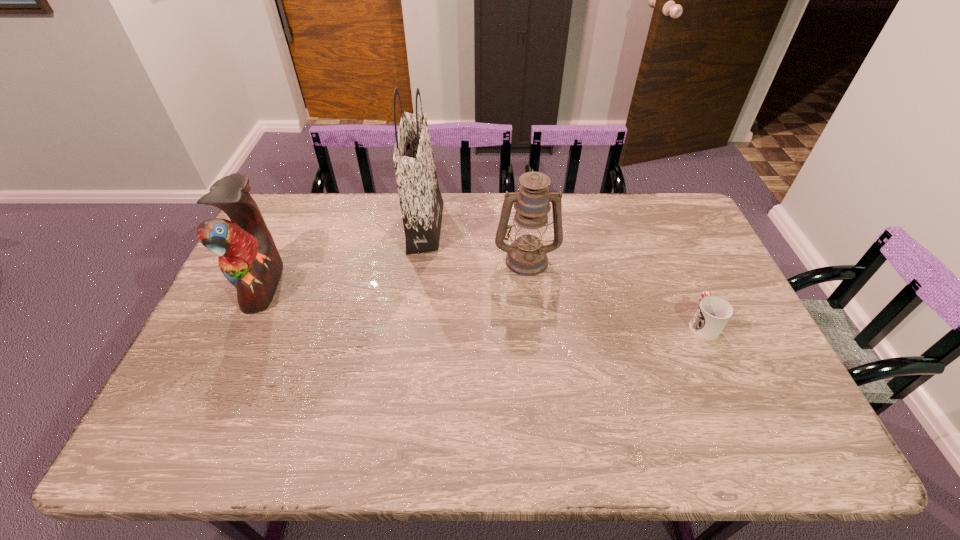
The image size is (960, 540). I want to click on object that is the second closest to the tallest object, so click(x=248, y=258).

Locate an element on the screen. This screenshot has width=960, height=540. object that is the second closest one to the cup is located at coordinates (421, 202).

Image resolution: width=960 pixels, height=540 pixels. Identify the location of vacant space that satisfies the following two spatial constraints: 1. on the front of the shopping bag with the design; 2. on the back side of the third object from left to right. (420, 259).

The width and height of the screenshot is (960, 540). Find the location of `vacant space that satisfies the following two spatial constraints: 1. on the handle side of the cup; 2. at the face of the leftmost object`. vacant space that satisfies the following two spatial constraints: 1. on the handle side of the cup; 2. at the face of the leftmost object is located at coordinates (685, 285).

This screenshot has height=540, width=960. Find the location of `vacant region that satisfies the following two spatial constraints: 1. at the face of the parrot; 2. on the handle side of the rightmost object`. vacant region that satisfies the following two spatial constraints: 1. at the face of the parrot; 2. on the handle side of the rightmost object is located at coordinates tap(245, 323).

Image resolution: width=960 pixels, height=540 pixels. Identify the location of vacant point that satisfies the following two spatial constraints: 1. on the front of the tallest object with the design; 2. on the back side of the oil lamp. (420, 259).

The image size is (960, 540). I want to click on free point that satisfies the following two spatial constraints: 1. on the front of the third object from right to left with the design; 2. on the right side of the second object from right to left, so click(420, 259).

The height and width of the screenshot is (540, 960). In order to click on vacant space that satisfies the following two spatial constraints: 1. on the front of the shopping bag with the design; 2. on the right side of the third object from left to right in this screenshot , I will do `click(420, 259)`.

Identify the location of vacant space that satisfies the following two spatial constraints: 1. on the front of the second object from left to right with the design; 2. on the back side of the second object from right to left. The height and width of the screenshot is (540, 960). (420, 259).

Locate an element on the screen. This screenshot has width=960, height=540. vacant region that satisfies the following two spatial constraints: 1. at the face of the parrot; 2. on the handle side of the cup is located at coordinates (245, 323).